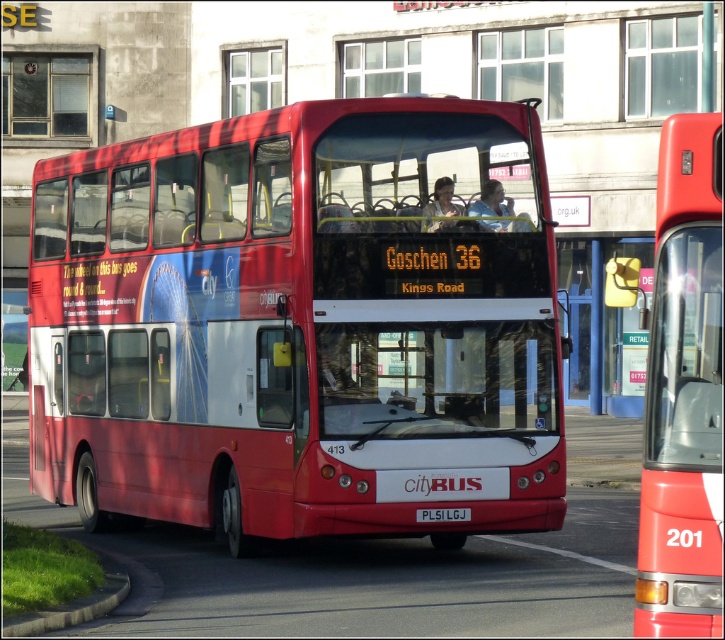
Between matte red bus at center and black plastic license plate at center, which one has less height?

black plastic license plate at center is shorter.

Can you confirm if matte red bus at center is smaller than black plastic license plate at center?

No.

Where is `matte red bus at center`? This screenshot has width=725, height=640. matte red bus at center is located at coordinates (683, 392).

The image size is (725, 640). What do you see at coordinates (442, 205) in the screenshot?
I see `matte plastic face at center` at bounding box center [442, 205].

The height and width of the screenshot is (640, 725). In order to click on matte plastic face at center in this screenshot , I will do `click(442, 205)`.

I want to click on matte plastic face at center, so click(442, 205).

What do you see at coordinates (302, 324) in the screenshot? This screenshot has height=640, width=725. I see `shiny red bus at center` at bounding box center [302, 324].

How much distance is there between shiny red bus at center and black plastic license plate at center?

shiny red bus at center and black plastic license plate at center are 3.15 meters apart.

At what (x,y) coordinates should I click in order to perform the action: click on shiny red bus at center. Please return your answer as a coordinate pair (x, y). The image size is (725, 640). Looking at the image, I should click on (302, 324).

Identify the location of shiny red bus at center. The image size is (725, 640). (302, 324).